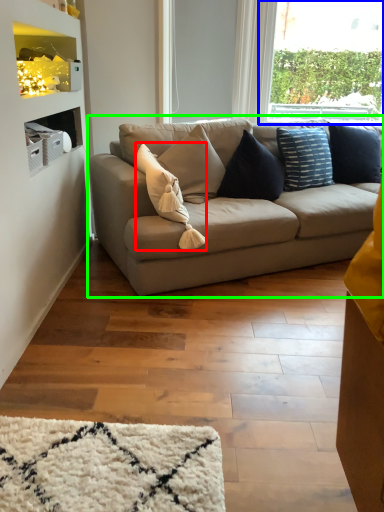
Question: Considering the real-world distances, which object is farthest from pillow (highlighted by a red box)? window (highlighted by a blue box) or studio couch (highlighted by a green box)?

Choices:
 (A) window
 (B) studio couch

Answer: (A)